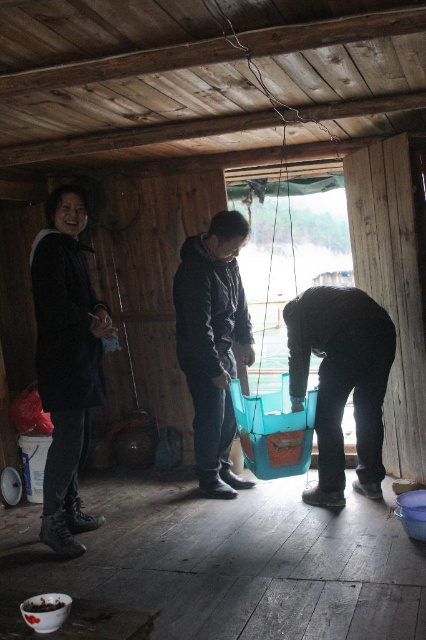
Question: In this image, where is matte black jacket at left located relative to blue plastic bucket at lower right?

Choices:
 (A) below
 (B) above

Answer: (B)

Question: Does matte black jacket at left have a lesser width compared to black matte jacket at center?

Choices:
 (A) yes
 (B) no

Answer: (A)

Question: Which of the following is the farthest from the observer?

Choices:
 (A) (x=393, y=326)
 (B) (x=215, y=474)
 (C) (x=42, y=320)
 (D) (x=40, y=609)

Answer: (B)

Question: Which is farther from the black matte jacket at center?

Choices:
 (A) matte black jacket at left
 (B) brown matte bowl at lower left
 (C) blue plastic bucket at lower right

Answer: (B)

Question: Which point is closer to the camera?

Choices:
 (A) matte black jacket at left
 (B) black matte jacket at center

Answer: (A)

Question: Is black matte jacket at center to the right of brown matte bowl at lower left from the viewer's perspective?

Choices:
 (A) no
 (B) yes

Answer: (B)